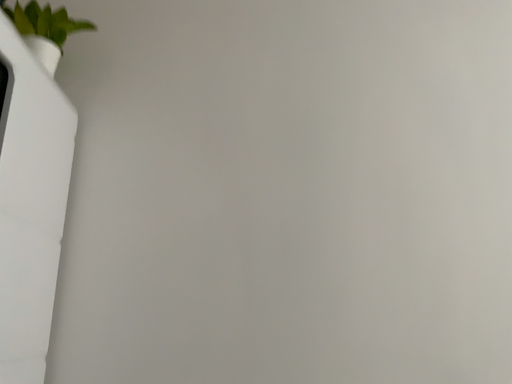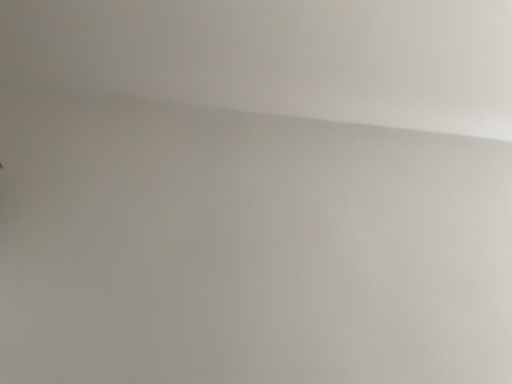
Question: Which way did the camera rotate in the video?

Choices:
 (A) rotated downward
 (B) rotated upward

Answer: (B)